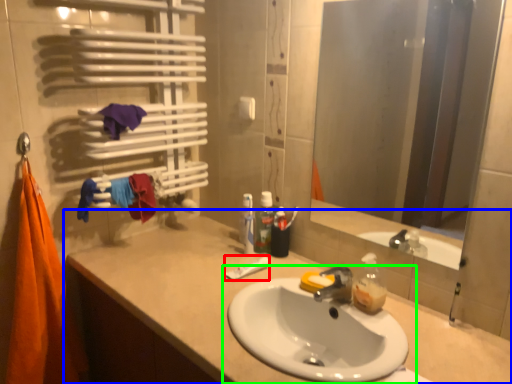
Question: Which is nearer to the toothpaste (highlighted by a red box)? bathroom cabinet (highlighted by a blue box) or sink (highlighted by a green box).

Choices:
 (A) bathroom cabinet
 (B) sink

Answer: (A)